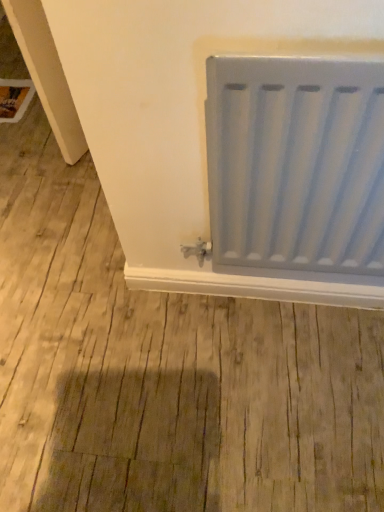
In order to click on free space in front of white matte window sill at lower center in this screenshot , I will do `click(258, 396)`.